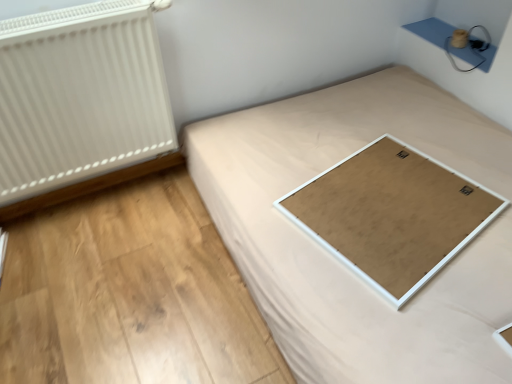
Image resolution: width=512 pixels, height=384 pixels. I want to click on vacant space in front of white matte board at center, so click(415, 314).